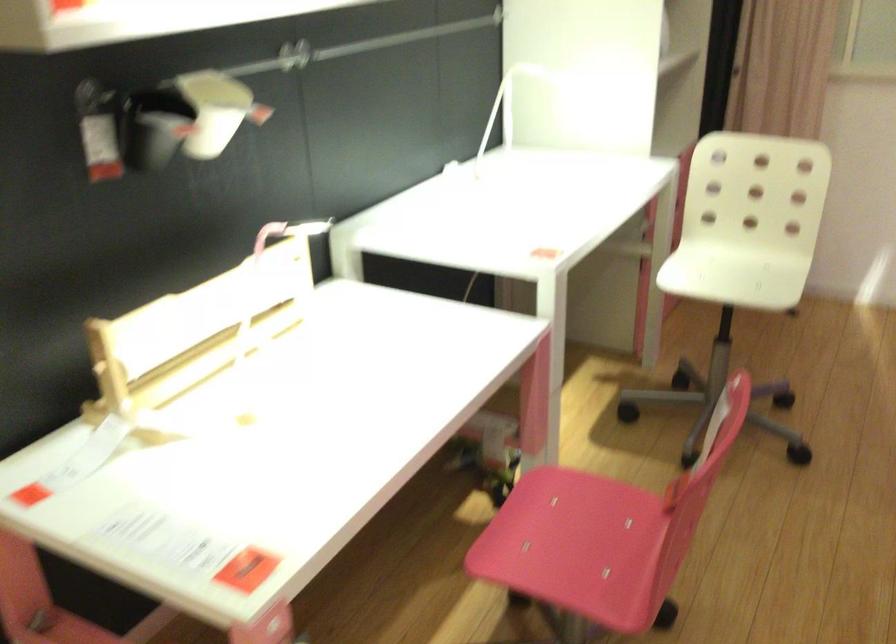
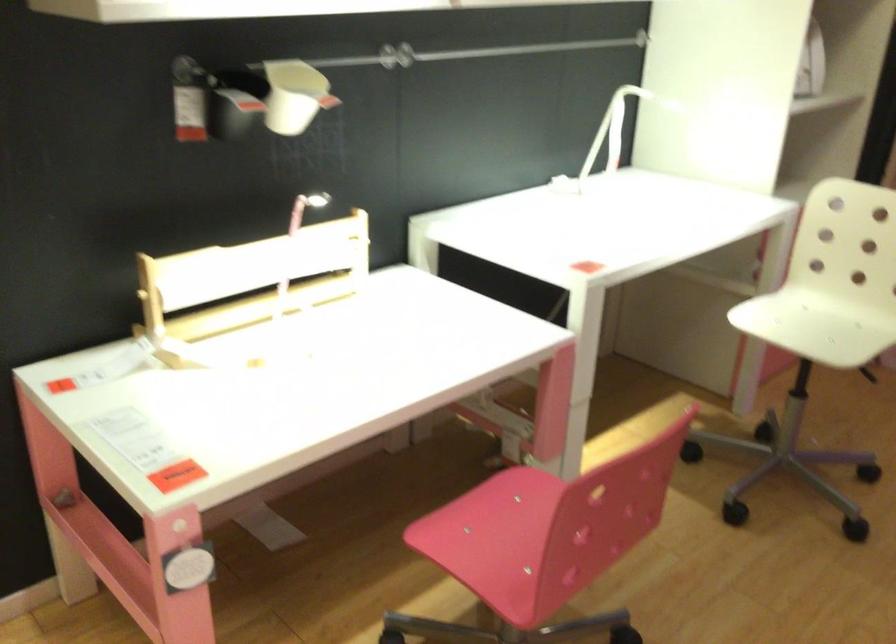
The point at (735,275) is marked in the first image. Where is the corresponding point in the second image?

(812, 327)